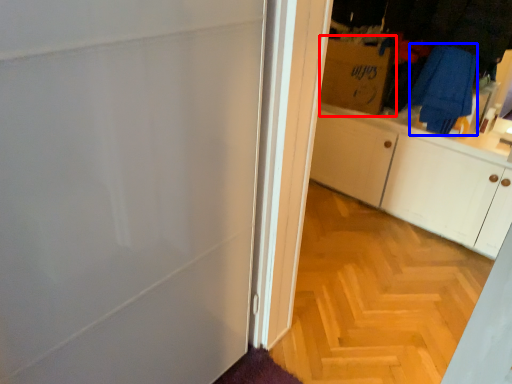
Question: Which object appears closest to the camera in this image, cardboard box (highlighted by a red box) or laundry (highlighted by a blue box)?

Choices:
 (A) cardboard box
 (B) laundry

Answer: (B)